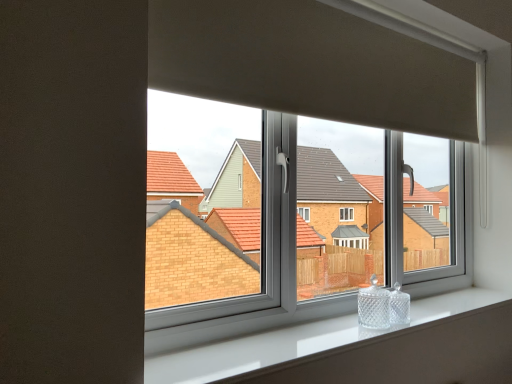
Question: Does white glossy window sill at lower center have a larger size compared to clear glass window at center?

Choices:
 (A) no
 (B) yes

Answer: (A)

Question: Would you say white glossy window sill at lower center contains clear glass window at center?

Choices:
 (A) no
 (B) yes

Answer: (A)

Question: From the image's perspective, is white glossy window sill at lower center above clear glass window at center?

Choices:
 (A) no
 (B) yes

Answer: (A)

Question: Is white glossy window sill at lower center to the left of clear glass window at center from the viewer's perspective?

Choices:
 (A) yes
 (B) no

Answer: (B)

Question: Does white glossy window sill at lower center lie behind clear glass window at center?

Choices:
 (A) yes
 (B) no

Answer: (B)

Question: Is white glossy window sill at lower center touching clear glass window at center?

Choices:
 (A) yes
 (B) no

Answer: (B)

Question: Can you confirm if clear glass window at center is thinner than white glossy window sill at lower center?

Choices:
 (A) no
 (B) yes

Answer: (B)

Question: From the image's perspective, is clear glass window at center located above white glossy window sill at lower center?

Choices:
 (A) no
 (B) yes

Answer: (B)

Question: Is clear glass window at center not inside white glossy window sill at lower center?

Choices:
 (A) no
 (B) yes

Answer: (B)

Question: Considering the relative sizes of clear glass window at center and white glossy window sill at lower center in the image provided, is clear glass window at center wider than white glossy window sill at lower center?

Choices:
 (A) yes
 (B) no

Answer: (B)

Question: Could you tell me if clear glass window at center is turned towards white glossy window sill at lower center?

Choices:
 (A) yes
 (B) no

Answer: (B)

Question: From a real-world perspective, is clear glass window at center under white glossy window sill at lower center?

Choices:
 (A) no
 (B) yes

Answer: (A)

Question: From the image's perspective, relative to clear glass window at center, is white glossy window sill at lower center above or below?

Choices:
 (A) below
 (B) above

Answer: (A)